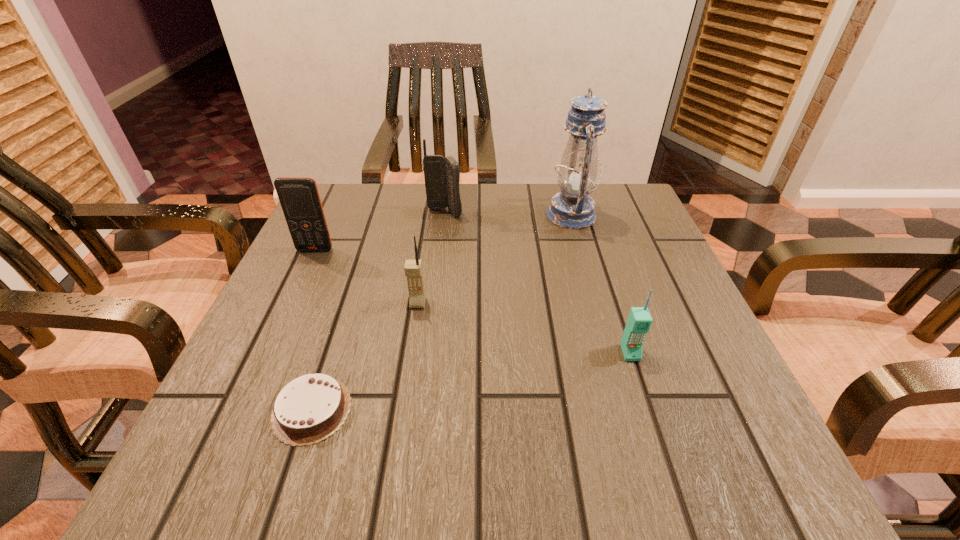
This screenshot has height=540, width=960. I want to click on lantern, so click(x=572, y=208).

Image resolution: width=960 pixels, height=540 pixels. Identify the location of the farthest cellular telephone. (442, 174).

Identify the location of the third farthest object. point(299,197).

Where is `the third nearest cellular telephone`? the third nearest cellular telephone is located at coordinates (299, 197).

You are a GUI agent. You are given a task and a screenshot of the screen. Output one action in this format:
    pyautogui.click(x=<x>, y=<y>)
    Task: Click on the third farthest cellular telephone
    The height and width of the screenshot is (540, 960).
    Given the screenshot: What is the action you would take?
    pyautogui.click(x=413, y=269)

Where is `the rightmost cellular telephone`? The width and height of the screenshot is (960, 540). the rightmost cellular telephone is located at coordinates (639, 321).

Where is `the fifth tallest object`? the fifth tallest object is located at coordinates [639, 321].

Locate an element on the screen. This screenshot has width=960, height=540. chocolate cake is located at coordinates (309, 409).

You are a GUI agent. You are given a task and a screenshot of the screen. Output one action in this format:
    pyautogui.click(x=<x>, y=<y>)
    Task: Click on the nearest object
    This screenshot has height=540, width=960.
    Given the screenshot: What is the action you would take?
    pyautogui.click(x=309, y=409)

The width and height of the screenshot is (960, 540). Identify the location of free space located 0.210m on the front-facing side of the lantern. (458, 215).